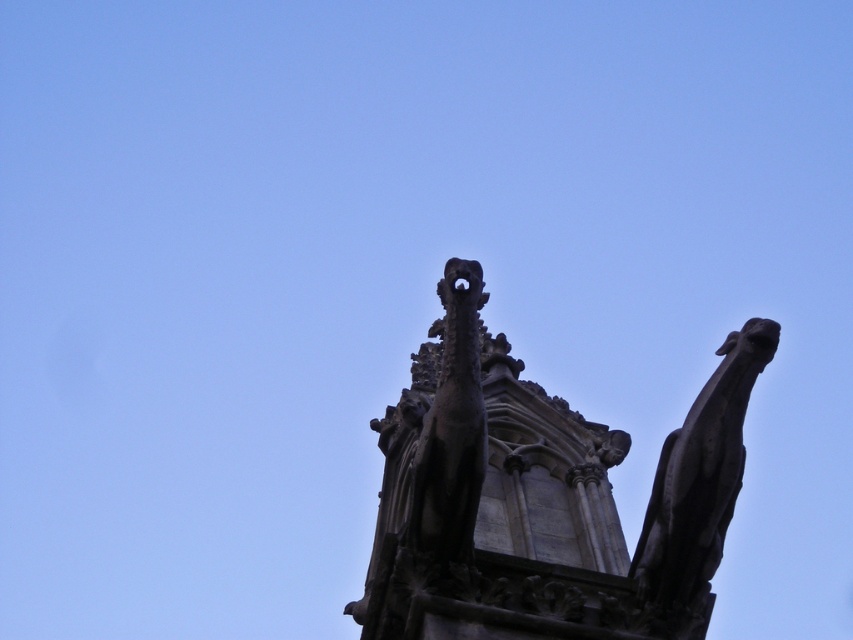
Does dark gray stone gargoyle at upper center have a greater width compared to dark gray stone gargoyle at upper right?

Indeed, dark gray stone gargoyle at upper center has a greater width compared to dark gray stone gargoyle at upper right.

Is dark gray stone gargoyle at upper center above dark gray stone gargoyle at upper right?

Yes.

Describe the element at coordinates (543, 497) in the screenshot. I see `dark gray stone gargoyle at upper center` at that location.

The image size is (853, 640). In order to click on dark gray stone gargoyle at upper center in this screenshot , I will do `click(543, 497)`.